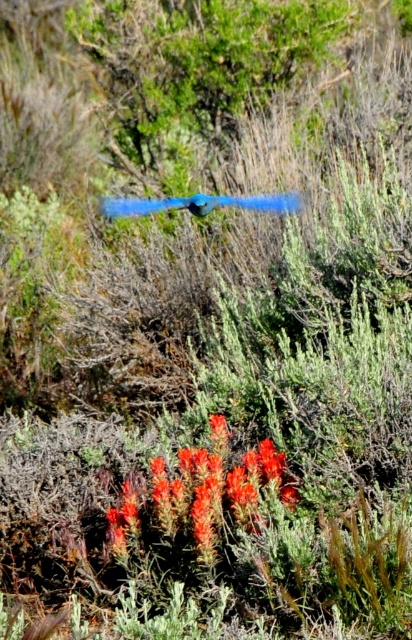
Identify the location of bright orange textured flower at lower center. (215, 490).

Between bright orange textured flower at lower center and blue feathered bird at center, which one appears on the right side from the viewer's perspective?

Positioned to the right is bright orange textured flower at lower center.

Where is `bright orange textured flower at lower center`? The height and width of the screenshot is (640, 412). bright orange textured flower at lower center is located at coordinates (215, 490).